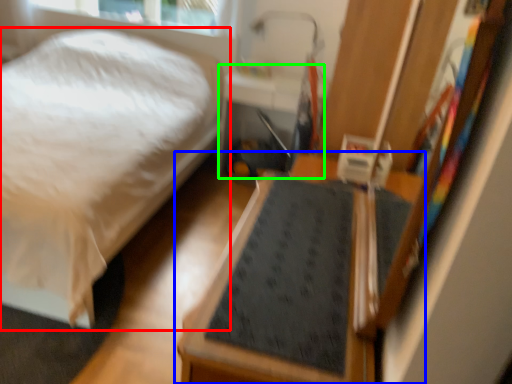
Question: Which is farther away from bed (highlighted by a red box)? furniture (highlighted by a blue box) or table (highlighted by a green box)?

Choices:
 (A) furniture
 (B) table

Answer: (A)